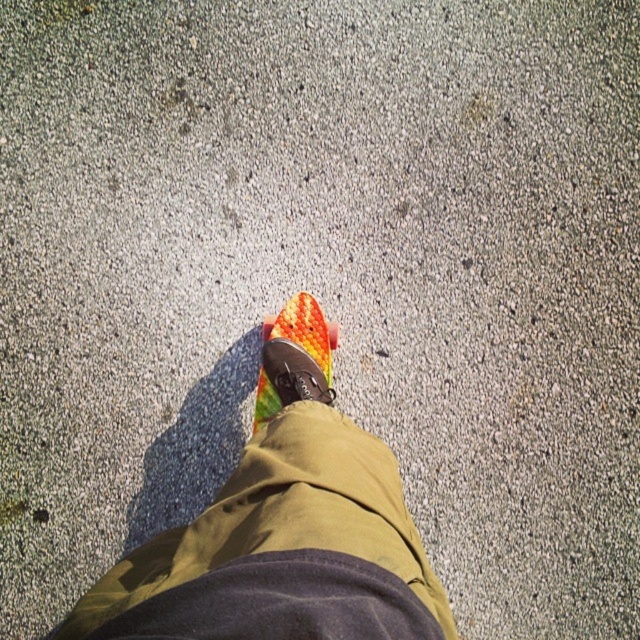
Does rubberized orange skateboard at center appear on the right side of multicolored rubber shoe at center?

In fact, rubberized orange skateboard at center is to the left of multicolored rubber shoe at center.

Does rubberized orange skateboard at center have a lesser width compared to multicolored rubber shoe at center?

Incorrect, rubberized orange skateboard at center's width is not less than multicolored rubber shoe at center's.

In the scene shown: Who is more forward, (x=266, y=365) or (x=266, y=385)?

Point (x=266, y=365)

In order to click on rubberized orange skateboard at center in this screenshot , I will do `click(282, 531)`.

Is rubberized orange skateboard at center behind orange textured toe at center?

That is False.

Is point (372, 458) farther from camera compared to point (330, 324)?

No, it is in front of (330, 324).

Identify the location of rubberized orange skateboard at center. (282, 531).

Between multicolored rubber shoe at center and orange textured toe at center, which one appears on the left side from the viewer's perspective?

multicolored rubber shoe at center is more to the left.

This screenshot has height=640, width=640. Identify the location of multicolored rubber shoe at center. (292, 358).

Locate an element on the screen. The width and height of the screenshot is (640, 640). multicolored rubber shoe at center is located at coordinates tap(292, 358).